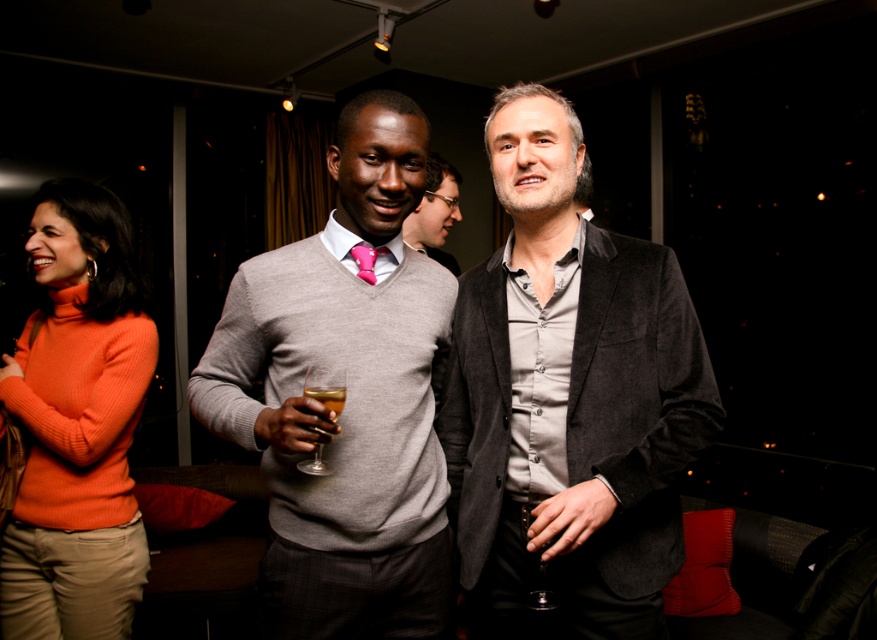
Question: Which object is positioned closest to the transparent glass at center?

Choices:
 (A) translucent glass wine glass at center
 (B) pink satin tie at center
 (C) velvet black blazer at center
 (D) matte gray sweater at center

Answer: (C)

Question: Which object appears farthest from the camera in this image?

Choices:
 (A) velvet black blazer at center
 (B) orange turtleneck sweater at left
 (C) translucent glass wine glass at center

Answer: (B)

Question: Does velvet black blazer at center have a smaller size compared to translucent glass wine at center?

Choices:
 (A) no
 (B) yes

Answer: (A)

Question: Does orange turtleneck sweater at left have a larger size compared to pink satin tie at center?

Choices:
 (A) yes
 (B) no

Answer: (A)

Question: Which point is closer to the camera?

Choices:
 (A) translucent glass wine glass at center
 (B) velvet black blazer at center

Answer: (B)

Question: Can you confirm if pink satin tie at center is positioned above transparent glass at center?

Choices:
 (A) yes
 (B) no

Answer: (A)